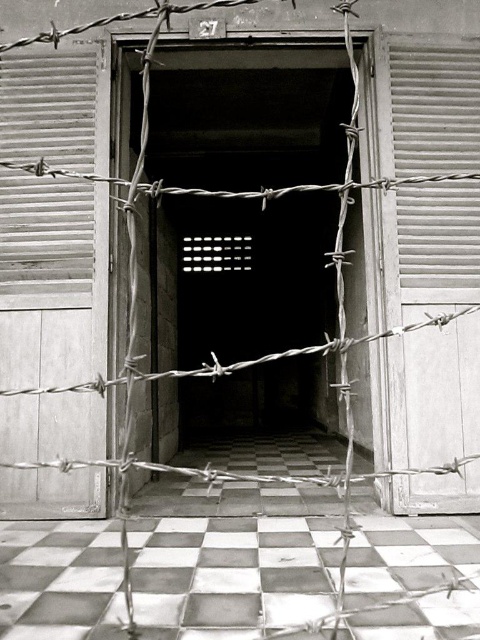
Who is lower down, metallic corrugated door at right or white wooden shutter at right?

Positioned lower is metallic corrugated door at right.

Who is taller, metallic corrugated door at right or white wooden shutter at right?

metallic corrugated door at right is taller.

Locate an element on the screen. The image size is (480, 640). metallic corrugated door at right is located at coordinates (427, 104).

Is metallic corrugated shutter at left positioned at the back of white wooden shutter at right?

Yes, it is.

Is point (48, 268) farther from camera compared to point (430, 241)?

Yes, it is behind point (430, 241).

Between point (79, 122) and point (421, 236), which one is positioned in front?

Point (421, 236)

You are a GUI agent. You are given a task and a screenshot of the screen. Output one action in this format:
    pyautogui.click(x=<x>, y=<y>)
    Task: Click on the metallic corrugated shutter at left
    Image resolution: width=480 pixels, height=640 pixels.
    Given the screenshot: What is the action you would take?
    pyautogui.click(x=48, y=106)

Consider the image. Which is more to the left, metallic corrugated door at right or metallic corrugated shutter at left?

From the viewer's perspective, metallic corrugated shutter at left appears more on the left side.

Where is `metallic corrugated door at right`? metallic corrugated door at right is located at coordinates (427, 104).

Image resolution: width=480 pixels, height=640 pixels. I want to click on metallic corrugated door at right, so click(x=427, y=104).